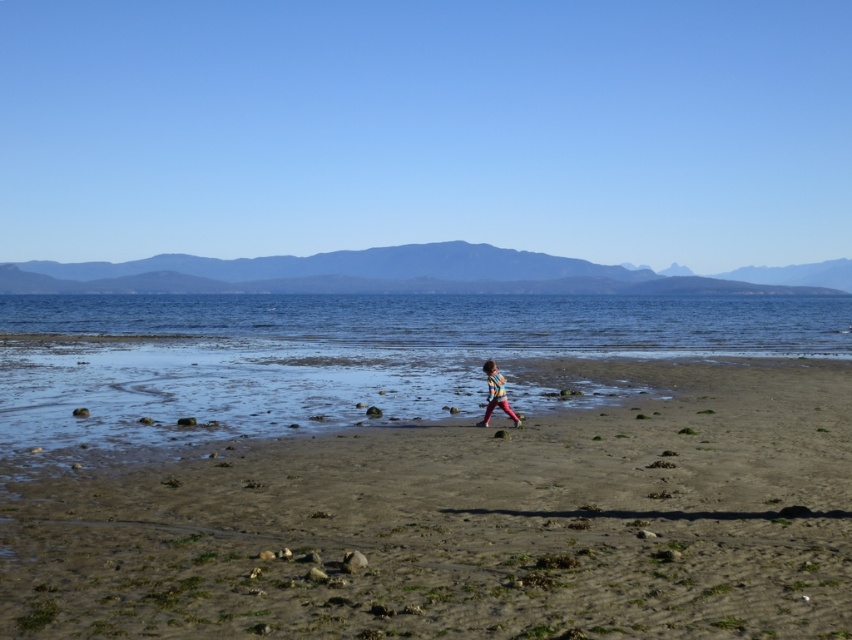
You are a photographer standing at the edge of the beach. You want to capture a photo that includes both the blue water at lower center and the striped shirt at center. Based on their heights, which object should be placed closer to the camera to ensure both are fully visible in the frame?

The blue water at lower center is taller than the striped shirt at center. To ensure both are fully visible, place the blue water at lower center closer to the camera since its greater height requires more vertical space in the frame.

You are standing on the beach and see two points marked in the image. Which point is closer to you, point (839, 300) or point (487, 369)?

Point (487, 369) is closer to you because it is less further to the viewer than point (839, 300).

You are a photographer planning to capture the entire scene of the brown sandy beach at center and the blue water at lower center in one shot. Based on their sizes, which object would occupy more of the frame?

The blue water at lower center would occupy more of the frame since it is larger in size compared to the brown sandy beach at center.